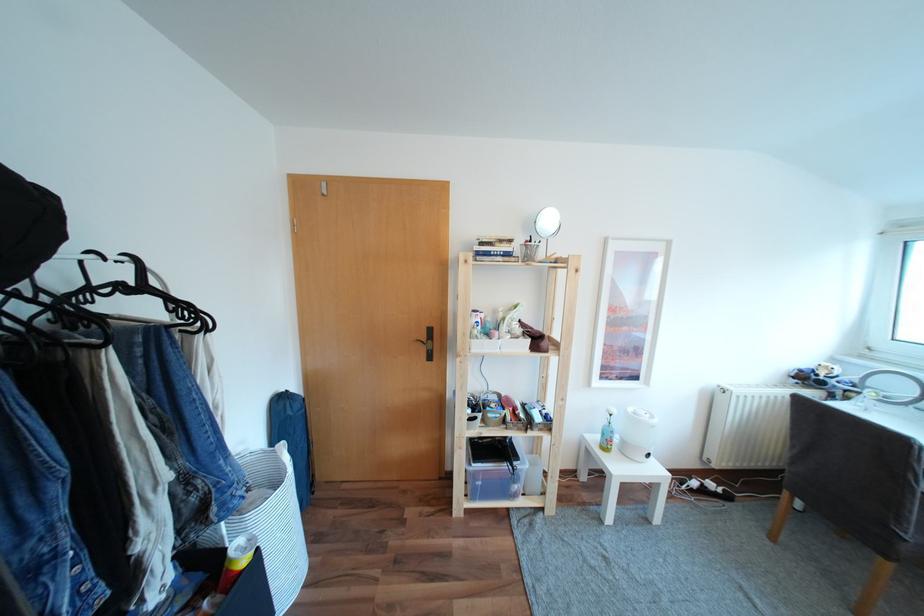
The location [546,224] corresponds to which object?

This point indicates the small round mirror.